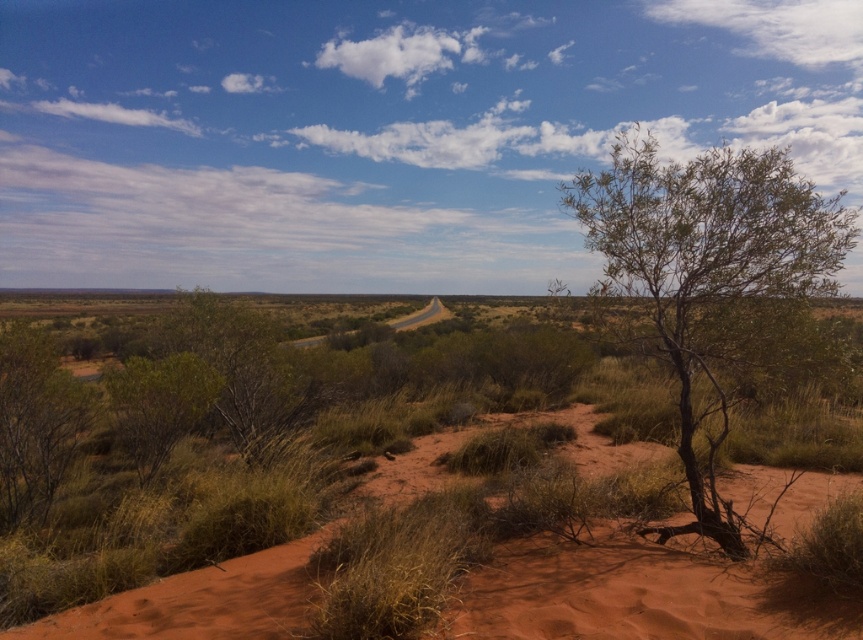
You are standing at the point with coordinates point (41,417) and want to walk to the point with coordinates point (835,604). According to the image, which direction should you face to walk towards your destination?

You should face towards the direction of point (835,604) because it is in front of point (41,417).